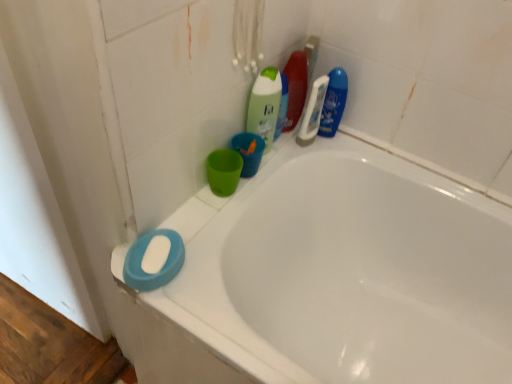
Image resolution: width=512 pixels, height=384 pixels. Find the location of `unoccupied region to the right of green matte bottle at upper center, the fourth cleaning product when ordered from right to left`. unoccupied region to the right of green matte bottle at upper center, the fourth cleaning product when ordered from right to left is located at coordinates (308, 147).